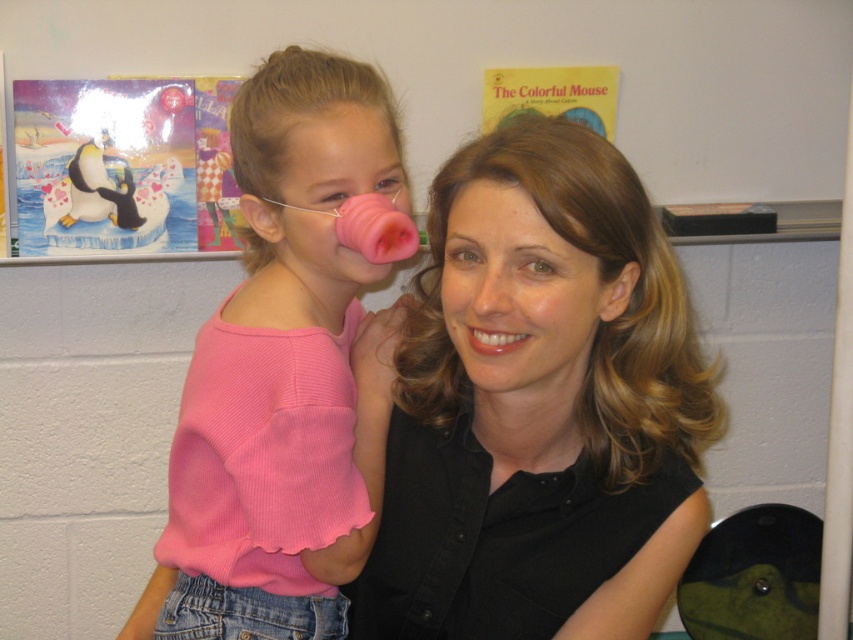
You are a photographer standing 40 inches away from the camera. You want to take a photo of the pink ribbed sweater at center. Is the sweater within your reach to adjust its position?

The pink ribbed sweater at center is 33.79 inches away from the camera, so since you are standing 40 inches away from the camera, the sweater is closer to the camera than you are. Therefore, you can reach it to adjust its position.

You are a photographer setting up for a portrait session. You notice the black matte shirt at center and the pink ribbed sweater at center in the frame. Which clothing item is closer to the camera?

The black matte shirt at center is closer to the camera since it is in front of the pink ribbed sweater at center.